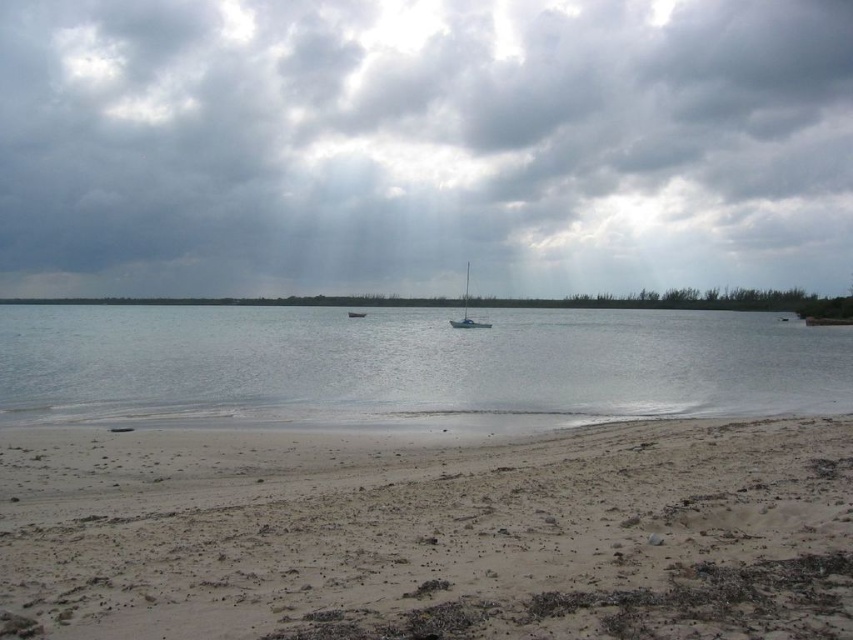
Is cloudy sky at upper center to the right of white matte sailboat at center from the viewer's perspective?

In fact, cloudy sky at upper center is to the left of white matte sailboat at center.

In order to click on cloudy sky at upper center in this screenshot , I will do `click(422, 145)`.

Who is more distant from viewer, (439, 579) or (457, 326)?

The point (457, 326) is more distant.

The image size is (853, 640). Describe the element at coordinates (428, 532) in the screenshot. I see `light brown sandy beach at lower center` at that location.

Between point (36, 442) and point (448, 323), which one is positioned in front?

Point (36, 442)

Locate an element on the screen. This screenshot has width=853, height=640. light brown sandy beach at lower center is located at coordinates (428, 532).

Between light brown sandy beach at lower center and clear water at lower left, which one is positioned lower?

light brown sandy beach at lower center is below.

Does point (276, 451) come behind point (424, 320)?

That is False.

Is point (846, 490) positioned before point (651, 323)?

Yes.

Image resolution: width=853 pixels, height=640 pixels. In order to click on light brown sandy beach at lower center in this screenshot , I will do `click(428, 532)`.